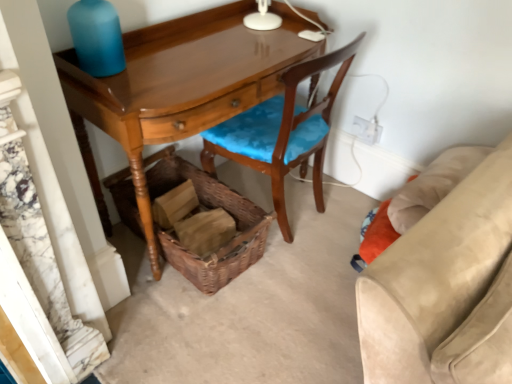
At what (x,y) coordinates should I click in order to perform the action: click on vacant space to the right of blue matte bottle at upper left. Please return your answer as a coordinate pair (x, y). The height and width of the screenshot is (384, 512). Looking at the image, I should click on (158, 67).